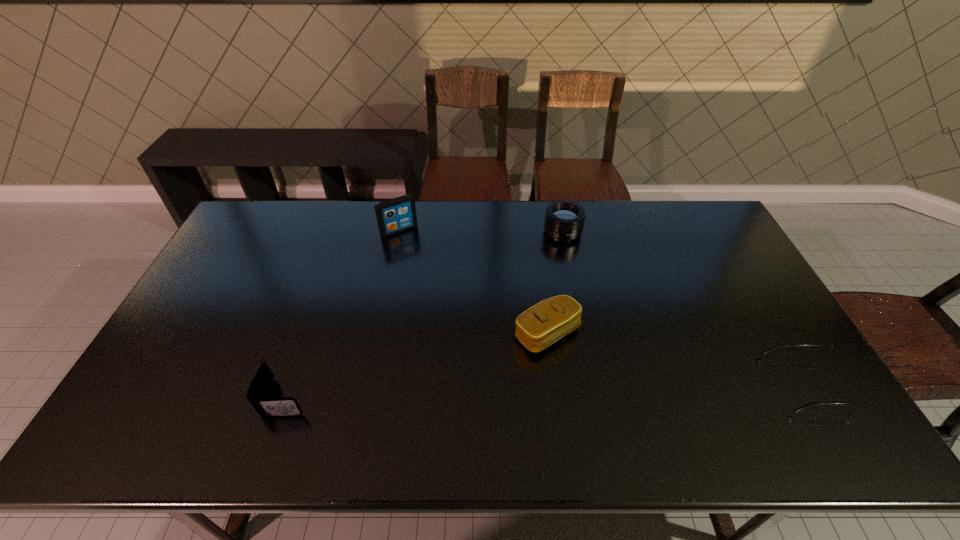
Where is `vacant position located 0.160m on the zipper side of the clutch bag`? vacant position located 0.160m on the zipper side of the clutch bag is located at coordinates (x=610, y=400).

You are a GUI agent. You are given a task and a screenshot of the screen. Output one action in this format:
    pyautogui.click(x=<x>, y=<y>)
    Task: Click on the free space located 0.140m on the front screen of the second object from left to right
    
    Given the screenshot: What is the action you would take?
    pyautogui.click(x=422, y=261)

This screenshot has width=960, height=540. In order to click on free location located 0.400m on the front screen of the second object from left to right in this screenshot , I will do `click(458, 313)`.

This screenshot has height=540, width=960. I want to click on vacant space located 0.260m on the front screen of the second object from left to right, so point(438,284).

Locate an element on the screen. blank area located on the side of the telephoto lens with brand markings and control switches is located at coordinates (531, 306).

Find the location of a particular element. The height and width of the screenshot is (540, 960). vacant area situated 0.290m on the side of the telephoto lens with brand markings and control switches is located at coordinates (533, 301).

You are a GUI agent. You are given a task and a screenshot of the screen. Output one action in this format:
    pyautogui.click(x=<x>, y=<y>)
    Task: Click on the vacant area located 0.260m on the side of the telephoto lens with brand markings and control switches
    
    Given the screenshot: What is the action you would take?
    pyautogui.click(x=536, y=294)

The width and height of the screenshot is (960, 540). What are the coordinates of `iPod at the far edge` in the screenshot? It's located at (398, 214).

In order to click on telephoto lens present at the far edge in this screenshot , I will do `click(564, 219)`.

This screenshot has width=960, height=540. I want to click on wallet at the near edge, so click(258, 390).